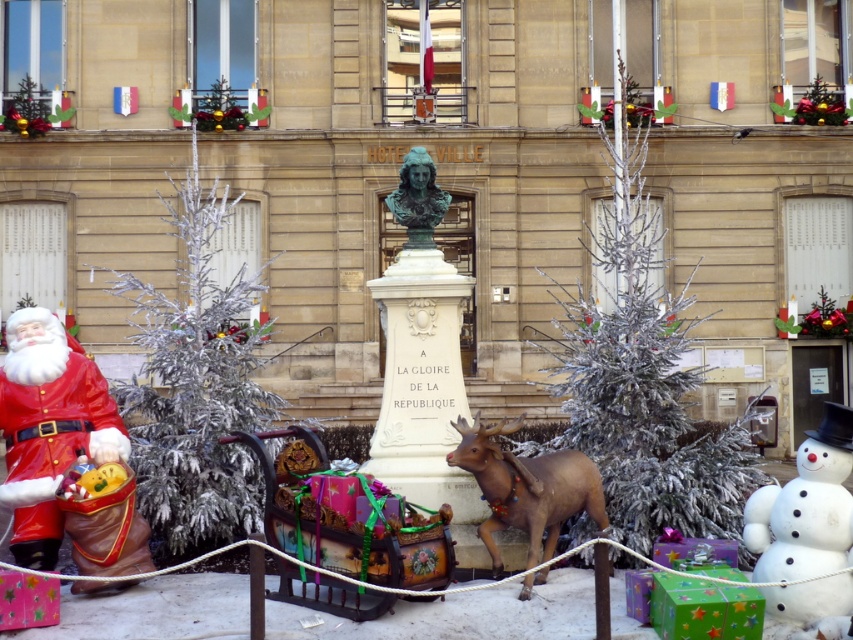
Is shiny red santa at left smaller than brown matte/decorative reindeer at center?

Yes.

Between point (28, 426) and point (457, 454), which one is positioned behind?

The point (28, 426) is behind.

This screenshot has height=640, width=853. I want to click on shiny red santa at left, so click(48, 428).

Which is in front, point (241, 294) or point (456, 451)?

Point (456, 451)

In order to click on silver metallic christmas tree at left in this screenshot , I will do `click(196, 381)`.

Which is more to the left, shiny red santa at left or white matte snowman at lower right?

shiny red santa at left

Does shiny red santa at left have a smaller size compared to white matte snowman at lower right?

Yes.

Is point (49, 400) in front of point (836, 634)?

That is False.

Identify the location of shiny red santa at left. This screenshot has width=853, height=640. (48, 428).